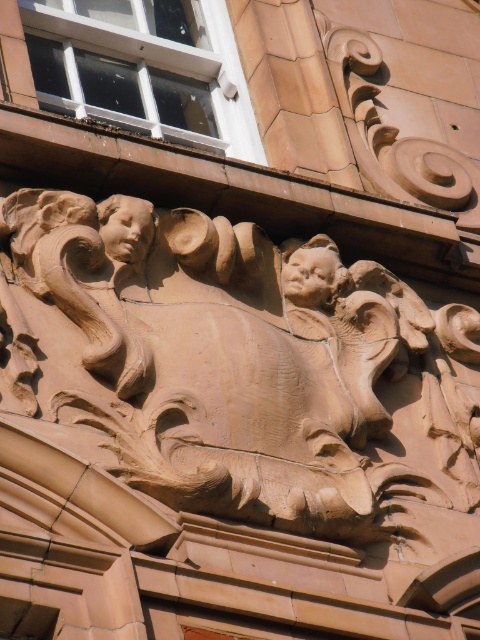
Question: Does matte brown head at center appear on the left side of matte stone face at upper left?

Choices:
 (A) no
 (B) yes

Answer: (A)

Question: Does brown stone sculpture at center have a smaller size compared to matte stone face at upper left?

Choices:
 (A) no
 (B) yes

Answer: (A)

Question: Which of the following is the closest to the observer?

Choices:
 (A) (118, 0)
 (B) (133, 198)
 (C) (84, 216)

Answer: (C)

Question: Which of the following is the closest to the observer?

Choices:
 (A) (192, 108)
 (B) (367, 376)
 (C) (123, 208)
 (D) (17, 205)

Answer: (D)

Question: Can you confirm if matte brown head at upper left is positioned to the right of matte brown head at center?

Choices:
 (A) no
 (B) yes

Answer: (A)

Question: Considering the real-world distances, which object is closest to the brown stone sculpture at center?

Choices:
 (A) matte brown head at upper left
 (B) matte glass window at upper left
 (C) matte brown head at center

Answer: (C)